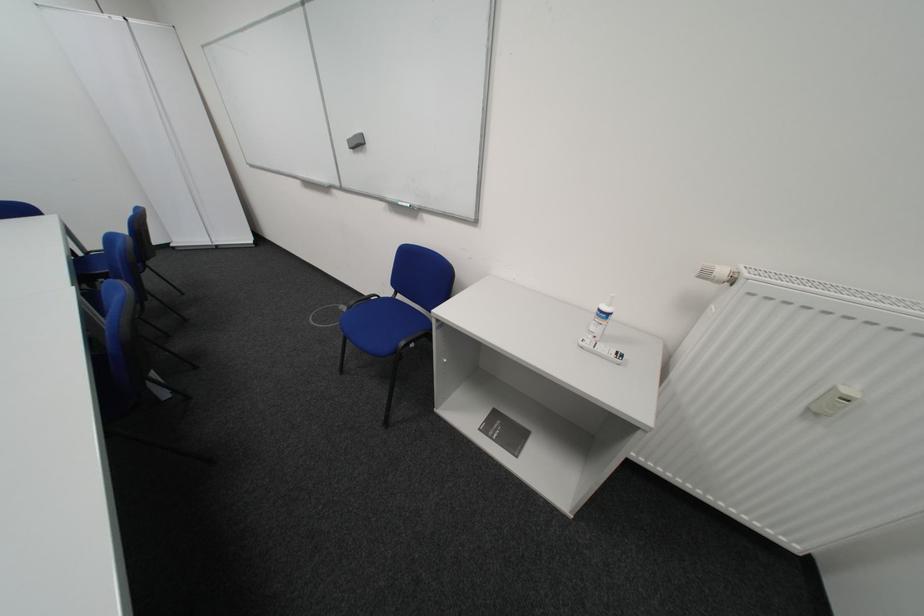
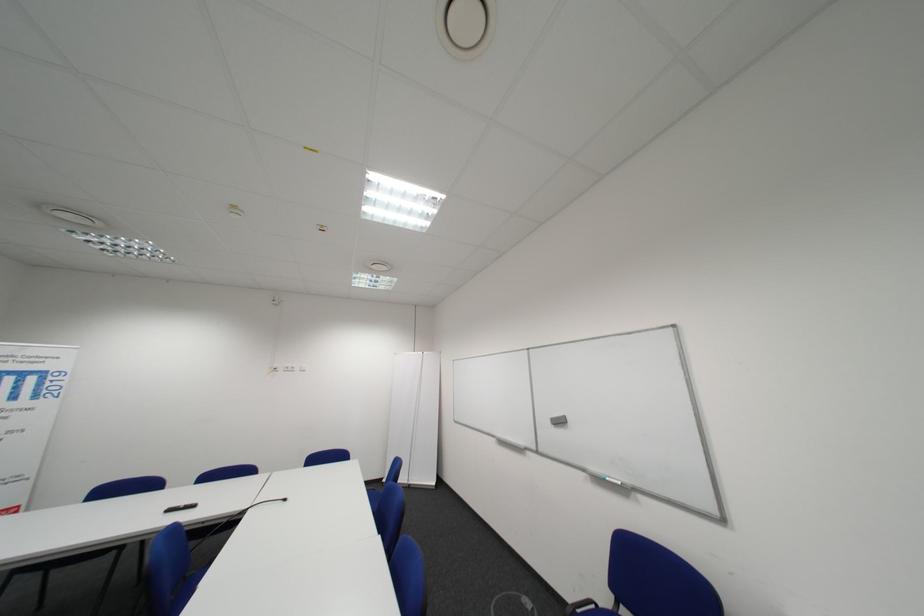
The images are taken continuously from a first-person perspective. In which direction is your viewpoint rotating?

The rotation direction of the camera is left-up.